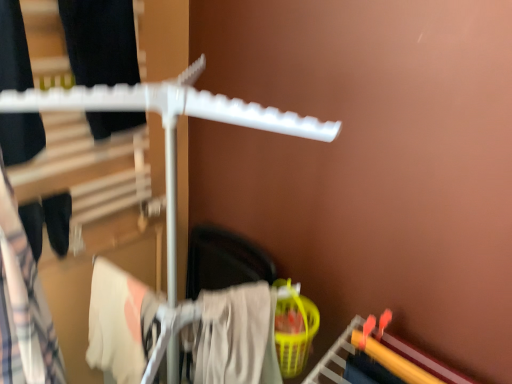
Question: Is matte black pants at left, arranged as the 3th clothing when viewed from the right, to the right of beige cotton towel at lower center, the 1th clothing viewed from the right, from the viewer's perspective?

Choices:
 (A) no
 (B) yes

Answer: (A)

Question: From a real-world perspective, is matte black pants at left, which ranks as the first clothing in left-to-right order, under beige cotton towel at lower center, the 1th clothing viewed from the right?

Choices:
 (A) no
 (B) yes

Answer: (A)

Question: Are matte black pants at left, arranged as the 3th clothing when viewed from the right, and beige cotton towel at lower center, placed as the third clothing when sorted from left to right, making contact?

Choices:
 (A) yes
 (B) no

Answer: (B)

Question: Does matte black pants at left, which ranks as the first clothing in left-to-right order, have a smaller size compared to beige cotton towel at lower center, placed as the third clothing when sorted from left to right?

Choices:
 (A) yes
 (B) no

Answer: (A)

Question: Is matte black pants at left, arranged as the 3th clothing when viewed from the right, at the left side of beige cotton towel at lower center, placed as the third clothing when sorted from left to right?

Choices:
 (A) no
 (B) yes

Answer: (B)

Question: Looking at their shapes, would you say matte black pants at left, which ranks as the first clothing in left-to-right order, is wider or thinner than white cotton towel at lower left, arranged as the second clothing when viewed from the left?

Choices:
 (A) thin
 (B) wide

Answer: (A)

Question: Is matte black pants at left, which ranks as the first clothing in left-to-right order, bigger or smaller than white cotton towel at lower left, which appears as the 2th clothing when viewed from the right?

Choices:
 (A) big
 (B) small

Answer: (A)

Question: Considering the relative positions of matte black pants at left, which ranks as the first clothing in left-to-right order, and white cotton towel at lower left, which appears as the 2th clothing when viewed from the right, in the image provided, is matte black pants at left, which ranks as the first clothing in left-to-right order, to the left or to the right of white cotton towel at lower left, which appears as the 2th clothing when viewed from the right,?

Choices:
 (A) left
 (B) right

Answer: (A)

Question: Considering the positions of matte black pants at left, arranged as the 3th clothing when viewed from the right, and white cotton towel at lower left, which appears as the 2th clothing when viewed from the right, in the image, is matte black pants at left, arranged as the 3th clothing when viewed from the right, taller or shorter than white cotton towel at lower left, which appears as the 2th clothing when viewed from the right,?

Choices:
 (A) short
 (B) tall

Answer: (B)

Question: Relative to beige cotton towel at lower center, placed as the third clothing when sorted from left to right, is white cotton towel at lower left, arranged as the second clothing when viewed from the left, in front or behind?

Choices:
 (A) behind
 (B) front

Answer: (A)

Question: Looking at their shapes, would you say white cotton towel at lower left, which appears as the 2th clothing when viewed from the right, is wider or thinner than beige cotton towel at lower center, placed as the third clothing when sorted from left to right?

Choices:
 (A) wide
 (B) thin

Answer: (A)

Question: Is white cotton towel at lower left, arranged as the second clothing when viewed from the left, inside or outside of beige cotton towel at lower center, the 1th clothing viewed from the right?

Choices:
 (A) outside
 (B) inside

Answer: (A)

Question: Does point (116, 279) appear closer or farther from the camera than point (184, 344)?

Choices:
 (A) farther
 (B) closer

Answer: (A)

Question: From a real-world perspective, is matte black pants at left, which ranks as the first clothing in left-to-right order, physically located above or below beige cotton towel at lower center, placed as the third clothing when sorted from left to right?

Choices:
 (A) below
 (B) above

Answer: (B)

Question: Is matte black pants at left, which ranks as the first clothing in left-to-right order, inside or outside of beige cotton towel at lower center, placed as the third clothing when sorted from left to right?

Choices:
 (A) inside
 (B) outside

Answer: (B)